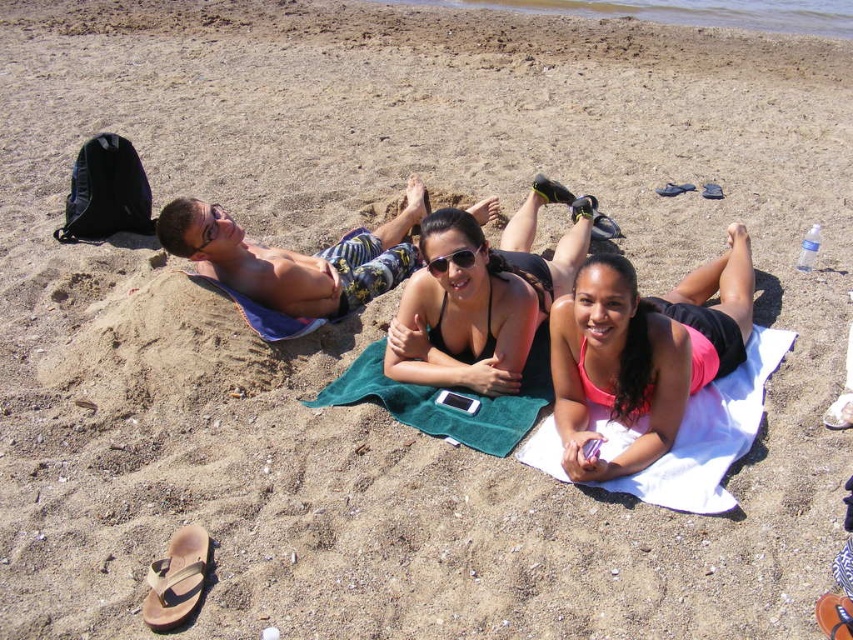
Question: Which object is the farthest from the black matte bikini top at center?

Choices:
 (A) green towel at center
 (B) brown leather sandal at lower left

Answer: (B)

Question: Does striped fabric shorts at center appear over brown leather sandal at lower left?

Choices:
 (A) no
 (B) yes

Answer: (B)

Question: Which point is closer to the camera taking this photo?

Choices:
 (A) (430, 368)
 (B) (274, 264)
 (C) (566, 401)
 (D) (500, 401)

Answer: (C)

Question: Among these objects, which one is nearest to the camera?

Choices:
 (A) green towel at center
 (B) sunglasses at center

Answer: (A)

Question: Can you confirm if striped fabric shorts at center is positioned above brown leather sandal at lower left?

Choices:
 (A) no
 (B) yes

Answer: (B)

Question: Does striped fabric shorts at center appear on the left side of green towel at center?

Choices:
 (A) yes
 (B) no

Answer: (A)